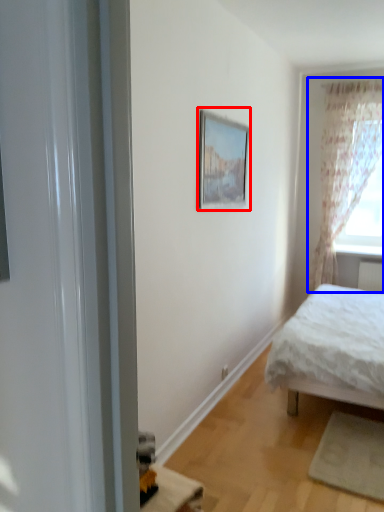
Question: Which object appears farthest to the camera in this image, picture frame (highlighted by a red box) or curtain (highlighted by a blue box)?

Choices:
 (A) picture frame
 (B) curtain

Answer: (B)